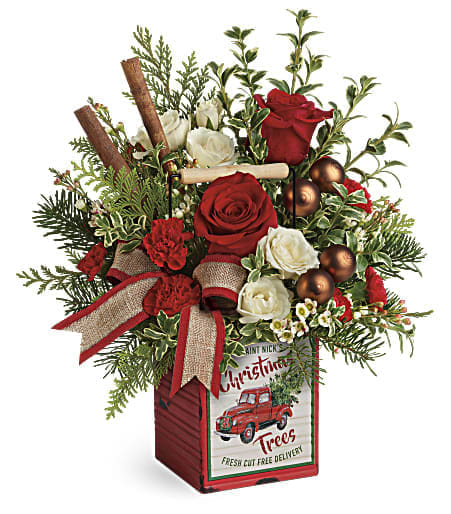
Locate an element on the screen. handle is located at coordinates (270, 169).